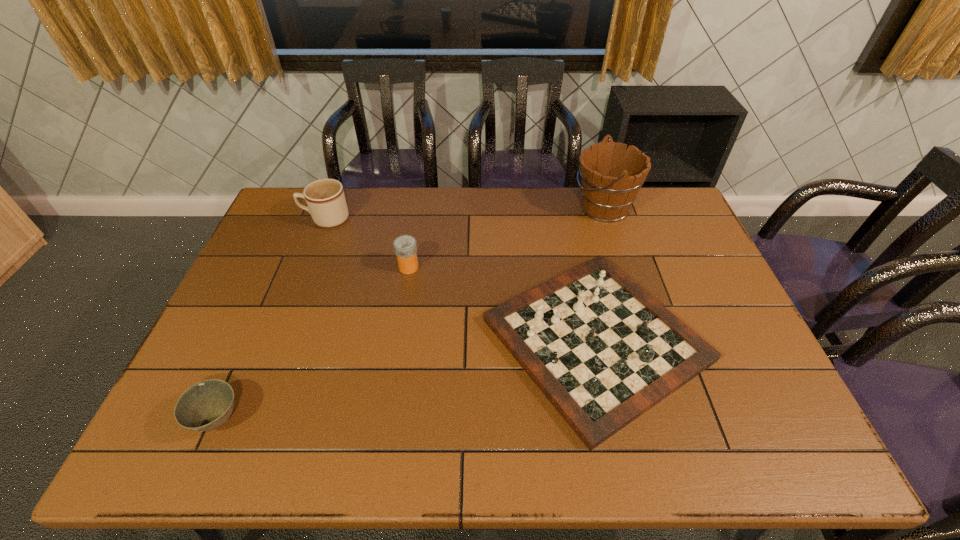
The image size is (960, 540). I want to click on free location that satisfies the following two spatial constraints: 1. on the back side of the bowl; 2. on the side of the mug with the handle, so click(305, 219).

At what (x,y) coordinates should I click in order to perform the action: click on free spot that satisfies the following two spatial constraints: 1. on the back side of the bowl; 2. on the side of the mug with the handle. Please return your answer as a coordinate pair (x, y). Looking at the image, I should click on point(305,219).

I want to click on free region that satisfies the following two spatial constraints: 1. with the handle on the wine bucket; 2. on the front side of the bowl, so click(x=671, y=419).

Image resolution: width=960 pixels, height=540 pixels. I want to click on free spot that satisfies the following two spatial constraints: 1. on the label side of the medicine; 2. on the back side of the chessboard, so click(397, 340).